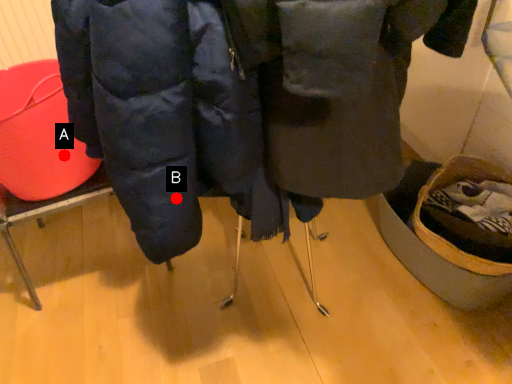
Question: Two points are circled on the image, labeled by A and B beside each circle. Which point is closer to the camera taking this photo?

Choices:
 (A) A is closer
 (B) B is closer

Answer: (B)